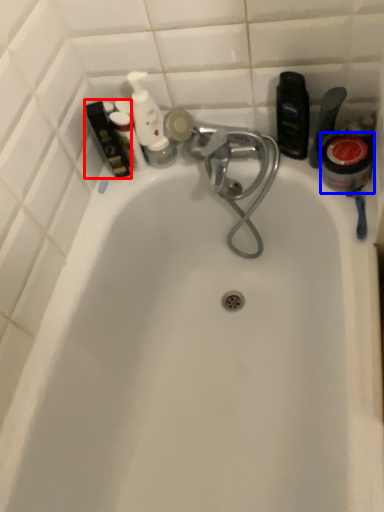
Question: Which object appears farthest to the camera in this image, toiletry (highlighted by a red box) or mouthwash (highlighted by a blue box)?

Choices:
 (A) toiletry
 (B) mouthwash

Answer: (A)